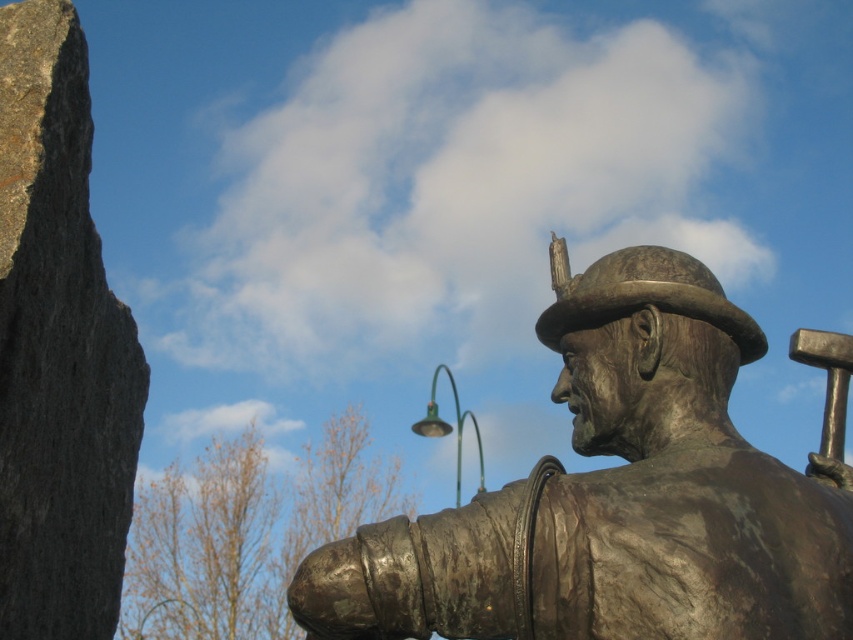
Question: Is bronze statue at center smaller than green metallic lamp post at upper center?

Choices:
 (A) no
 (B) yes

Answer: (B)

Question: Among these points, which one is nearest to the camera?

Choices:
 (A) (36, 292)
 (B) (456, 394)
 (C) (303, 625)

Answer: (C)

Question: Where is bronze statue at center located in relation to green metallic lamp post at upper center in the image?

Choices:
 (A) right
 (B) left

Answer: (A)

Question: Which is nearer to the bronze statue at center?

Choices:
 (A) green metallic lamp post at upper center
 (B) gray rough stone at left

Answer: (B)

Question: Which object is closer to the camera taking this photo?

Choices:
 (A) bronze statue at center
 (B) gray rough stone at left
 (C) green metallic lamp post at upper center

Answer: (A)

Question: Does bronze statue at center have a lesser width compared to green metallic lamp post at upper center?

Choices:
 (A) yes
 (B) no

Answer: (A)